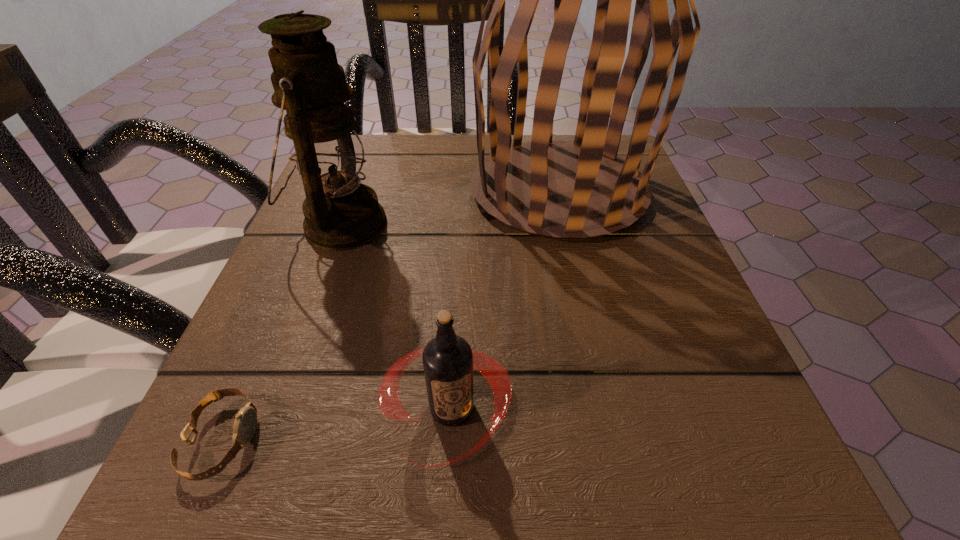
The height and width of the screenshot is (540, 960). What are the coordinates of `watch situated at the near edge` in the screenshot? It's located at (245, 423).

Locate an element on the screen. This screenshot has height=540, width=960. oil lamp positioned at the left edge is located at coordinates (341, 213).

This screenshot has height=540, width=960. Find the location of `watch that is at the left edge`. watch that is at the left edge is located at coordinates (245, 423).

Identify the location of object present at the right edge. Image resolution: width=960 pixels, height=540 pixels. (561, 190).

I want to click on object that is at the far left corner, so click(x=341, y=213).

Identify the location of object present at the near left corner. The width and height of the screenshot is (960, 540). (245, 423).

Locate an element on the screen. The height and width of the screenshot is (540, 960). object that is at the far right corner is located at coordinates (561, 190).

Locate an element on the screen. free space at the far edge of the desktop is located at coordinates (450, 161).

Identify the location of free space at the near edge of the desktop. [x=412, y=451].

You are a GUI agent. You are given a task and a screenshot of the screen. Output one action in this format:
    pyautogui.click(x=<x>, y=<y>)
    Task: Click on the vacant space at the left edge of the desktop
    The image size is (960, 540).
    Given the screenshot: What is the action you would take?
    pyautogui.click(x=356, y=254)